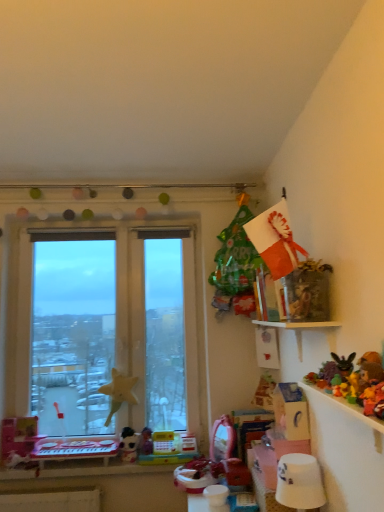
Question: Can you confirm if transparent glass window at left is smaller than fluffy yellow teddy bear at upper right, acting as the first toy starting from the right?

Choices:
 (A) yes
 (B) no

Answer: (B)

Question: From the image's perspective, is transparent glass window at left located above fluffy yellow teddy bear at upper right, which is counted as the fourth toy, starting from the left?

Choices:
 (A) yes
 (B) no

Answer: (B)

Question: Is transparent glass window at left positioned far away from fluffy yellow teddy bear at upper right, positioned as the 4th toy in bottom-to-top order?

Choices:
 (A) yes
 (B) no

Answer: (A)

Question: From the image's perspective, does transparent glass window at left appear lower than fluffy yellow teddy bear at upper right, which is counted as the fourth toy, starting from the left?

Choices:
 (A) yes
 (B) no

Answer: (A)

Question: Is transparent glass window at left oriented towards fluffy yellow teddy bear at upper right, the third toy viewed from the back?

Choices:
 (A) yes
 (B) no

Answer: (A)

Question: Visually, is multicolored plastic toy at upper right, the second toy from the back, positioned to the left or to the right of white plastic table at lower left?

Choices:
 (A) left
 (B) right

Answer: (B)

Question: In terms of size, does multicolored plastic toy at upper right, positioned as the 3th toy in top-to-bottom order, appear bigger or smaller than white plastic table at lower left?

Choices:
 (A) small
 (B) big

Answer: (A)

Question: Is multicolored plastic toy at upper right, the second toy from the back, taller or shorter than white plastic table at lower left?

Choices:
 (A) tall
 (B) short

Answer: (B)

Question: Looking at their shapes, would you say multicolored plastic toy at upper right, the second toy from the bottom, is wider or thinner than white plastic table at lower left?

Choices:
 (A) wide
 (B) thin

Answer: (B)

Question: Is white glossy lampshade at lower right taller or shorter than white plastic table at lower left?

Choices:
 (A) tall
 (B) short

Answer: (A)

Question: Visually, is white glossy lampshade at lower right positioned to the left or to the right of white plastic table at lower left?

Choices:
 (A) right
 (B) left

Answer: (A)

Question: From the image's perspective, is white glossy lampshade at lower right positioned above or below white plastic table at lower left?

Choices:
 (A) below
 (B) above

Answer: (B)

Question: Is point (304, 458) closer or farther from the camera than point (86, 442)?

Choices:
 (A) closer
 (B) farther

Answer: (A)

Question: Is white plush toy at lower center, which is counted as the fourth toy, starting from the right, situated inside multicolored plastic toy at upper right, positioned as the 3th toy in top-to-bottom order, or outside?

Choices:
 (A) outside
 (B) inside

Answer: (A)

Question: Considering the positions of white plush toy at lower center, positioned as the 1th toy in back-to-front order, and multicolored plastic toy at upper right, the second toy from the bottom, in the image, is white plush toy at lower center, positioned as the 1th toy in back-to-front order, taller or shorter than multicolored plastic toy at upper right, the second toy from the bottom,?

Choices:
 (A) tall
 (B) short

Answer: (A)